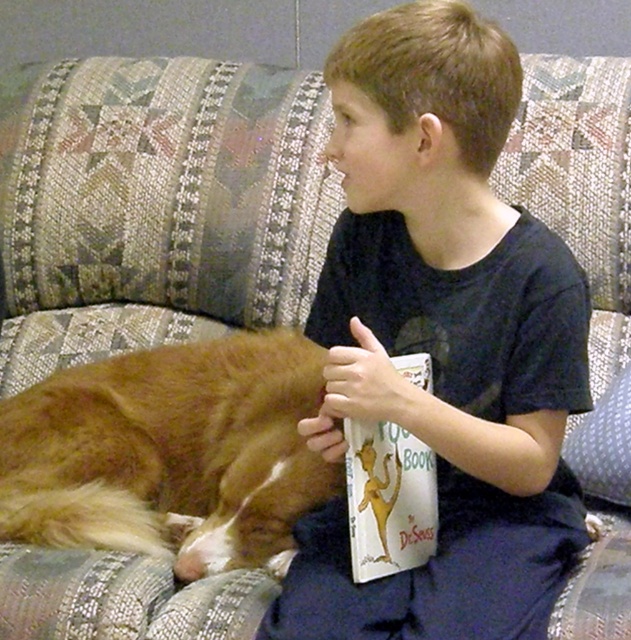
You are trying to determine if the golden fur dog at lower left can fit on the couch next to the white paper book at center. Based on their widths, can the dog and book be placed side by side without overlapping?

The golden fur dog at lower left is wider than the white paper book at center. Since the dog is wider, there might not be enough space for both to be placed side by side without overlapping, depending on the couch width.

You are a delivery robot that needs to place a small package between the dark blue cotton shirt at center and the golden fur dog at lower left. The package is 30 centimeters long. Will there be enough space between them to fit the package?

The distance between the dark blue cotton shirt at center and the golden fur dog at lower left is 35.36 centimeters. Since the package is 30 centimeters long, there is enough space to place it between them.